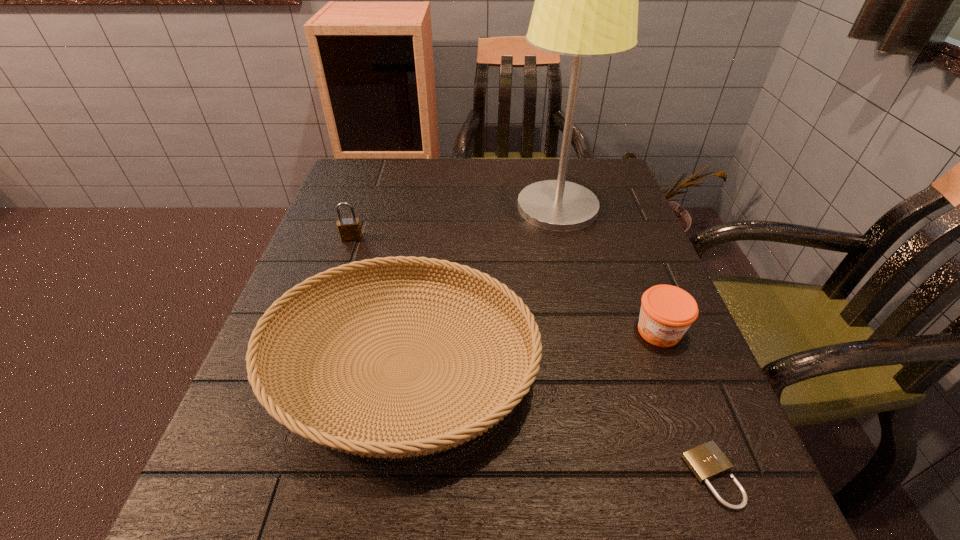
At what (x,y) coordinates should I click in order to perform the action: click on the farthest object. Please return your answer as a coordinate pair (x, y). This screenshot has height=540, width=960. Looking at the image, I should click on (586, 0).

Image resolution: width=960 pixels, height=540 pixels. In order to click on the tallest object in this screenshot , I will do `click(586, 0)`.

This screenshot has height=540, width=960. Identify the location of the taller padlock. (349, 228).

This screenshot has width=960, height=540. In order to click on the second farthest object in this screenshot , I will do 349,228.

Where is `basket`? basket is located at coordinates (262, 380).

This screenshot has width=960, height=540. What are the coordinates of `the second shortest object` in the screenshot? It's located at (667, 311).

Find the location of a particular element. This screenshot has width=960, height=540. the right padlock is located at coordinates (706, 461).

Locate an element on the screen. This screenshot has height=540, width=960. the shorter padlock is located at coordinates (706, 461).

Where is `free location located 0.370m on the left of the farthest object`? free location located 0.370m on the left of the farthest object is located at coordinates (368, 207).

Locate an element on the screen. This screenshot has width=960, height=540. vacant space positioned 0.360m on the right of the taller padlock is located at coordinates (518, 238).